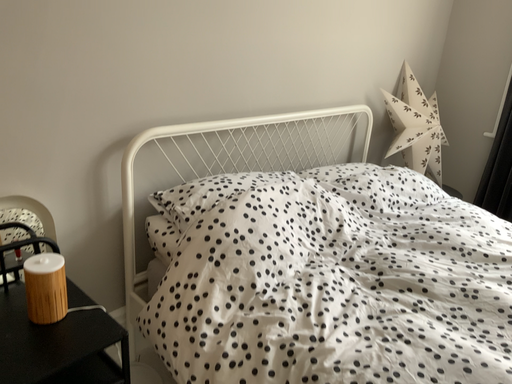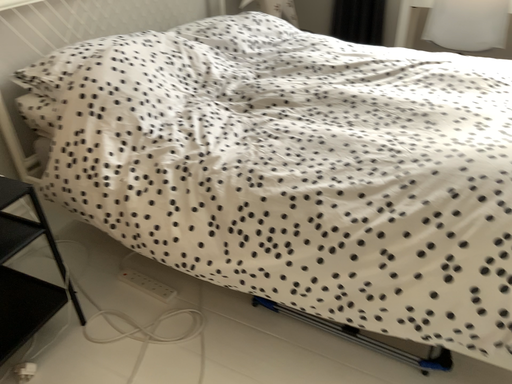
Question: Which way did the camera rotate in the video?

Choices:
 (A) rotated right
 (B) rotated left

Answer: (A)